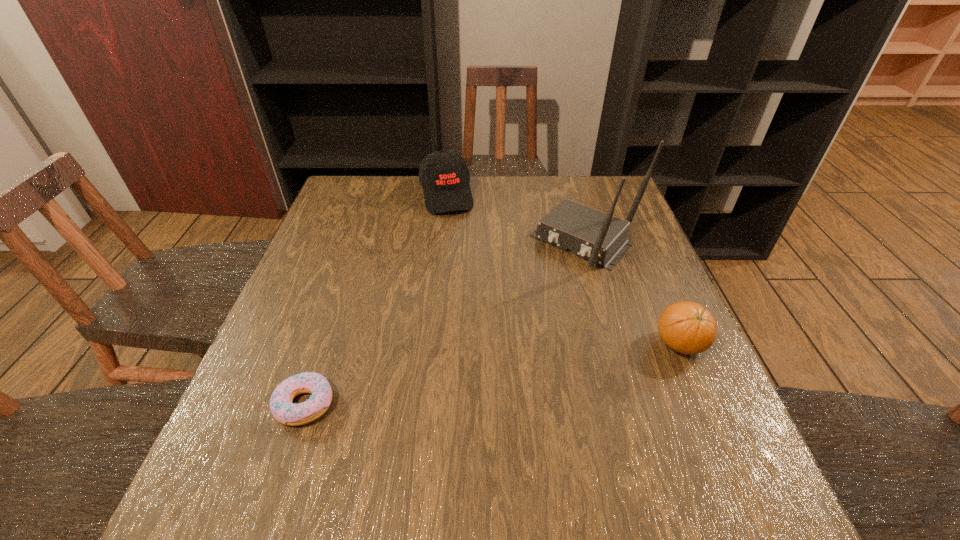
Point out which object is positioned as the second nearest to the leftmost object. Please provide its 2D coordinates. Your answer should be formatted as a tuple, i.e. [(x, y)], where the tuple contains the x and y coordinates of a point satisfying the conditions above.

[(444, 175)]